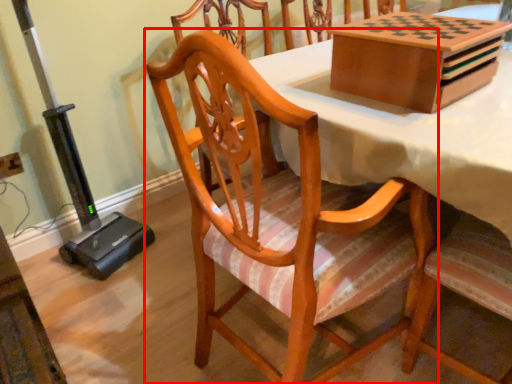
Question: Observing the image, what is the correct spatial positioning of chair (annotated by the red box) in reference to cardboard box?

Choices:
 (A) right
 (B) left

Answer: (B)